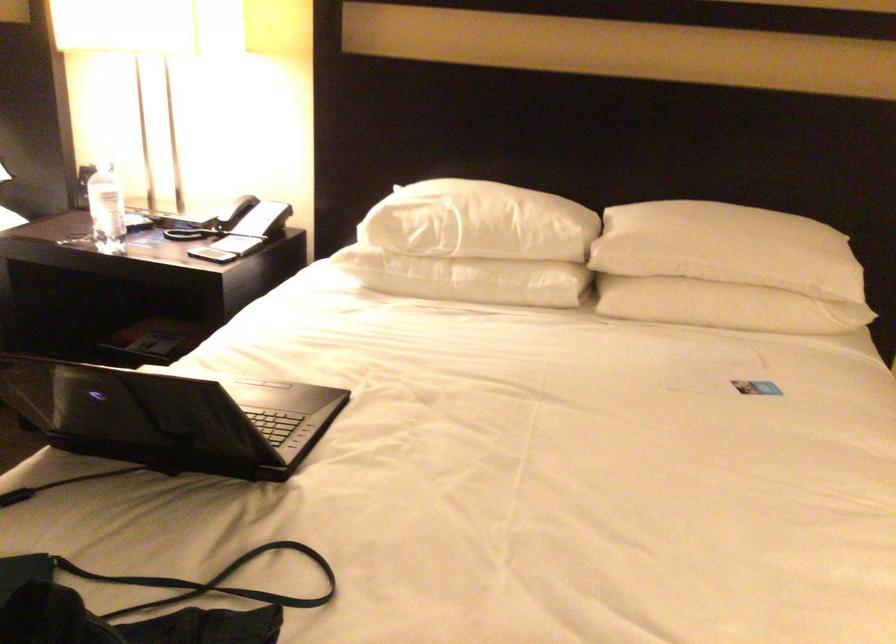
You are a GUI agent. You are given a task and a screenshot of the screen. Output one action in this format:
    pyautogui.click(x=<x>, y=<y>)
    Task: Click on the black bag strap
    This screenshot has height=644, width=896.
    Given the screenshot: What is the action you would take?
    pyautogui.click(x=211, y=581)